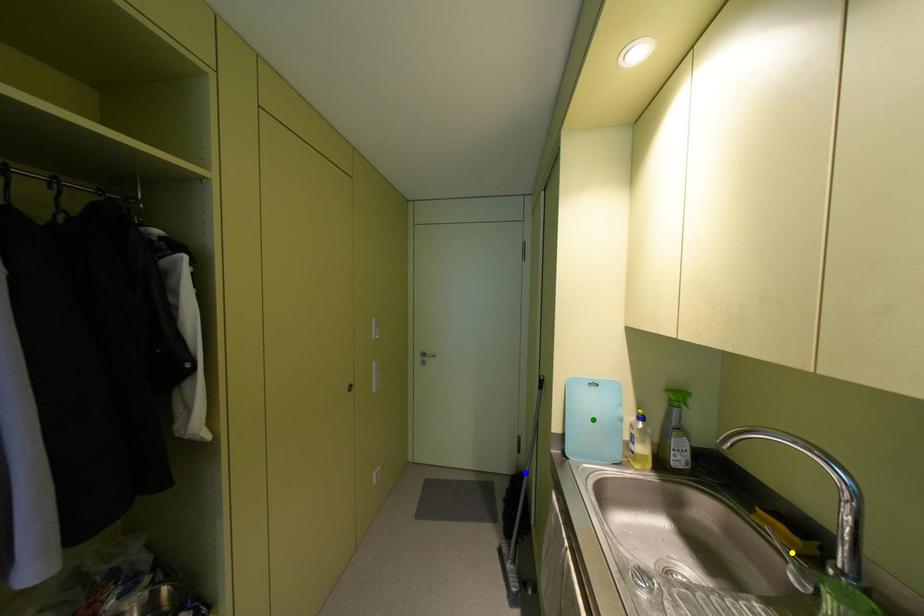
Order these from nearest to farthest:
A) blue point
B) yellow point
C) green point

yellow point, green point, blue point